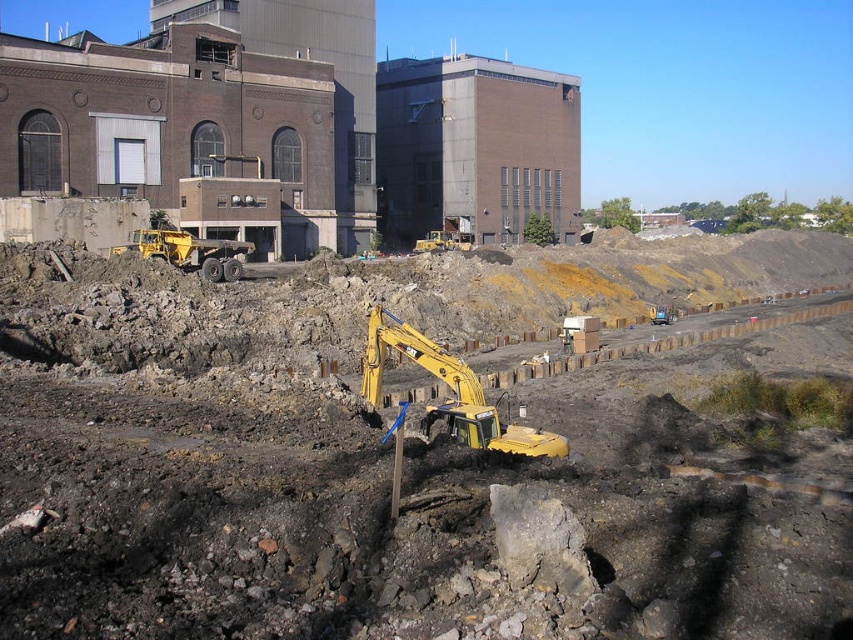
Question: From the image, what is the correct spatial relationship of yellow metal excavator at center in relation to yellow metallic excavator at left?

Choices:
 (A) below
 (B) above

Answer: (A)

Question: Considering the real-world distances, which object is farthest from the yellow metallic excavator at center?

Choices:
 (A) yellow metallic excavator at left
 (B) yellow metal excavator at center

Answer: (A)

Question: Which point is closer to the camera taking this photo?

Choices:
 (A) (202, 268)
 (B) (393, 337)

Answer: (B)

Question: Does yellow metal excavator at center appear on the right side of yellow metallic excavator at center?

Choices:
 (A) no
 (B) yes

Answer: (B)

Question: Which object is farther from the camera taking this photo?

Choices:
 (A) yellow metallic excavator at left
 (B) yellow metallic excavator at center

Answer: (A)

Question: Can you confirm if yellow metal excavator at center is positioned to the right of yellow metallic excavator at left?

Choices:
 (A) no
 (B) yes

Answer: (B)